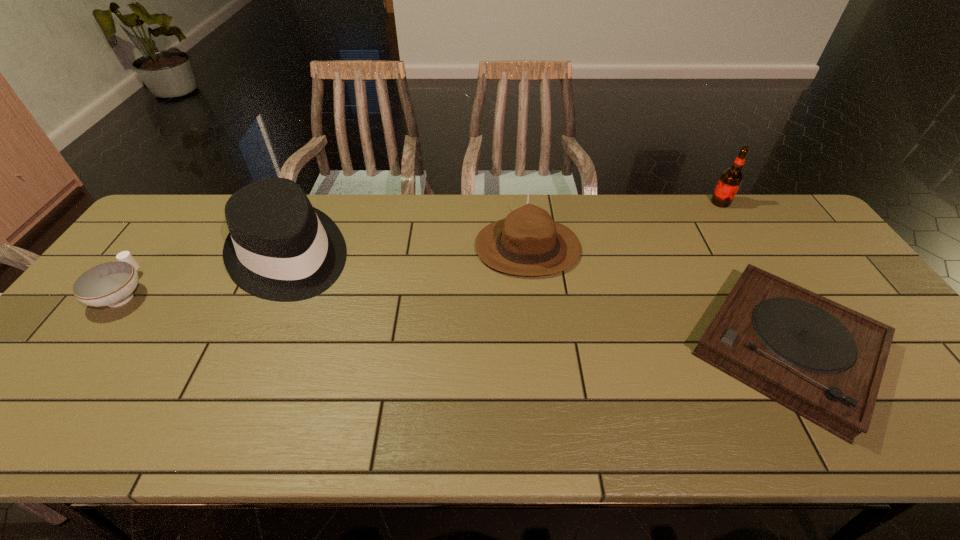
The width and height of the screenshot is (960, 540). I want to click on vacant space located 0.240m on the feather side of the right fedora, so [x=396, y=247].

Identify the location of vacant space located 0.060m on the feather side of the right fedora. (455, 247).

You are a GUI agent. You are given a task and a screenshot of the screen. Output one action in this format:
    pyautogui.click(x=<x>, y=<y>)
    Task: Click on the vacant space located on the side with the handle of the leftmost object
    
    Given the screenshot: What is the action you would take?
    pyautogui.click(x=165, y=238)

Where is `vacant space situated 0.070m on the side with the handle of the leftmost object`? This screenshot has width=960, height=540. vacant space situated 0.070m on the side with the handle of the leftmost object is located at coordinates (154, 253).

Where is `free space located 0.100m on the side with the handle of the leftmost object`? The height and width of the screenshot is (540, 960). free space located 0.100m on the side with the handle of the leftmost object is located at coordinates (158, 247).

This screenshot has height=540, width=960. What are the coordinates of `free space located 0.090m on the back of the phonograph record` in the screenshot? It's located at (733, 256).

This screenshot has width=960, height=540. What are the coordinates of `root beer present at the far edge` in the screenshot? It's located at (731, 179).

This screenshot has width=960, height=540. Identify the location of object present at the near edge. point(824,361).

The image size is (960, 540). I want to click on object that is at the left edge, so click(x=111, y=284).

Where is `object at the right edge`? object at the right edge is located at coordinates (824, 361).